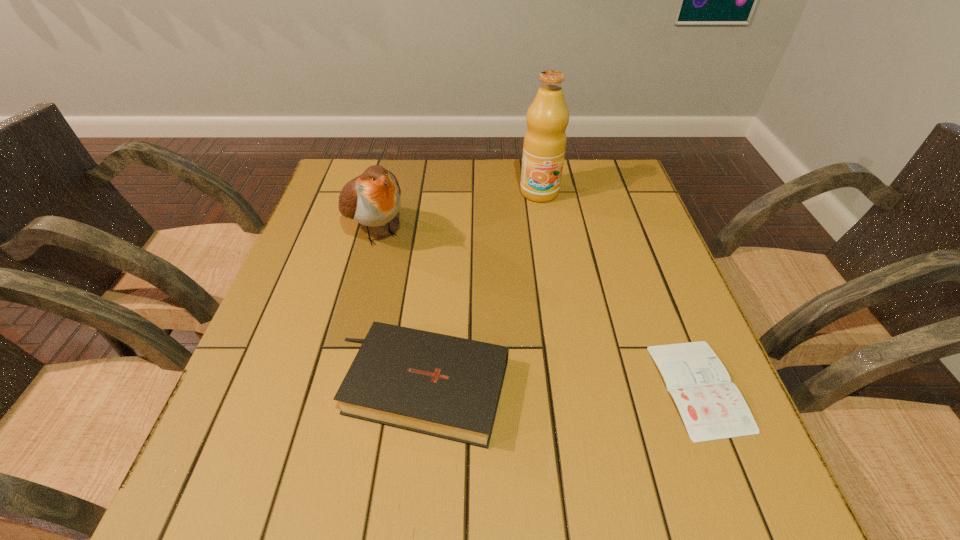
Locate an element on the screen. The image size is (960, 540). object that is at the near right corner is located at coordinates coord(712,408).

Where is `vacant area at the far edge of the desktop`? The image size is (960, 540). vacant area at the far edge of the desktop is located at coordinates (422, 192).

In the image, there is a desktop. Where is `vacant space at the near edge`? Image resolution: width=960 pixels, height=540 pixels. vacant space at the near edge is located at coordinates (527, 441).

In the image, there is a desktop. Identify the location of vacant space at the left edge. This screenshot has height=540, width=960. coord(327,345).

In the image, there is a desktop. Find the location of `blank space at the right edge`. blank space at the right edge is located at coordinates (602, 270).

Where is `free space at the near left corner of the desktop`? The width and height of the screenshot is (960, 540). free space at the near left corner of the desktop is located at coordinates (290, 402).

In order to click on free location at the far right corner of the desktop in this screenshot , I will do `click(614, 191)`.

What are the coordinates of `free spot between the bird and the third object from left to right` in the screenshot? It's located at (457, 211).

Identify the location of empty space that is in between the shortest object and the bird. (537, 309).

Locate an element on the screen. The height and width of the screenshot is (540, 960). free space that is in between the Bible and the bird is located at coordinates (397, 309).